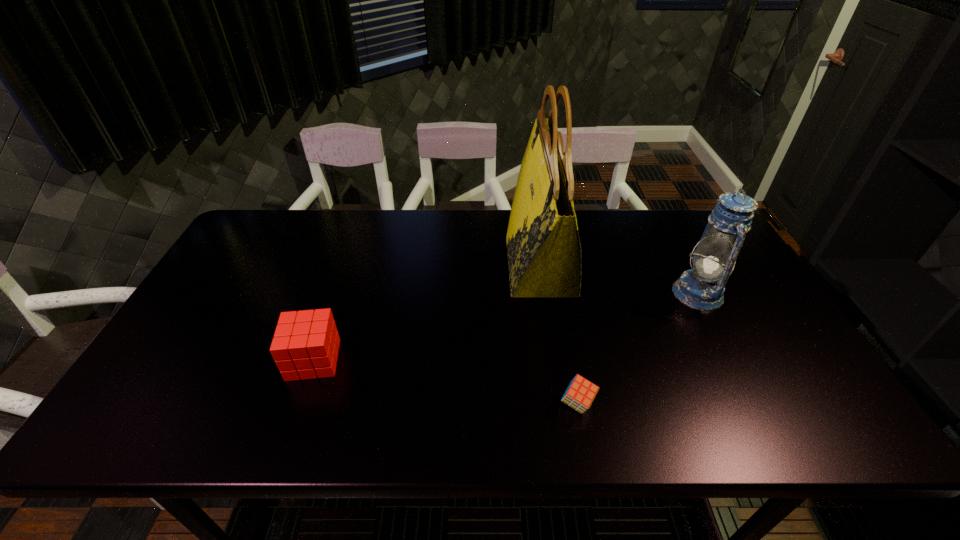
Locate an element on the screen. This screenshot has width=960, height=540. vacant space located 0.060m on the front-facing side of the rightmost object is located at coordinates (653, 293).

Locate an element on the screen. The image size is (960, 540). blank space located 0.060m on the front-facing side of the rightmost object is located at coordinates (653, 293).

Image resolution: width=960 pixels, height=540 pixels. Identify the location of vacant point located on the front-facing side of the rightmost object. [x=580, y=293].

Where is `vacant space located 0.100m on the front of the leftmost object`? The image size is (960, 540). vacant space located 0.100m on the front of the leftmost object is located at coordinates (293, 420).

Where is `free space located 0.380m on the back of the shorter cube`? free space located 0.380m on the back of the shorter cube is located at coordinates coord(554,278).

At what (x,y) coordinates should I click in order to perform the action: click on object that is at the far edge. Please return your answer as a coordinate pair (x, y). The image size is (960, 540). Looking at the image, I should click on pyautogui.click(x=544, y=252).

You are a GUI agent. You are given a task and a screenshot of the screen. Output one action in this format:
    pyautogui.click(x=<x>, y=<y>)
    Task: Click on the object at the near edge
    
    Given the screenshot: What is the action you would take?
    pyautogui.click(x=580, y=393)

The image size is (960, 540). Identify the location of object positioned at the right edge. (702, 287).

Where is `free space at the far edge`? The image size is (960, 540). free space at the far edge is located at coordinates (490, 244).

Where is `vacant space at the near edge of the desktop`? The height and width of the screenshot is (540, 960). vacant space at the near edge of the desktop is located at coordinates (521, 404).